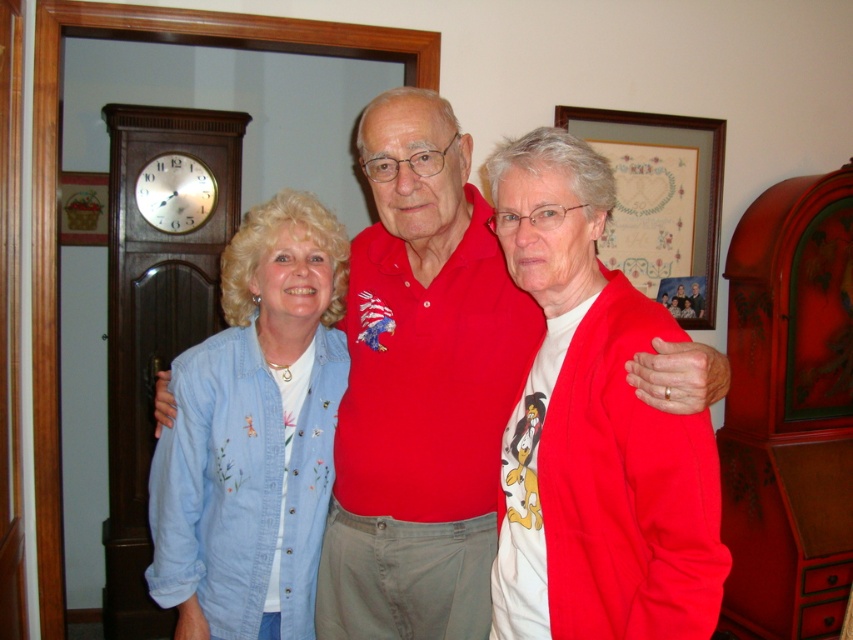
Question: Estimate the real-world distances between objects in this image. Which object is closer to the denim jacket at center?

Choices:
 (A) metallic clock at upper left
 (B) wooden framed picture at upper center

Answer: (B)

Question: Can you confirm if white cotton t-shirt at center is positioned to the right of denim jacket at left?

Choices:
 (A) yes
 (B) no

Answer: (A)

Question: Which of the following is the closest to the observer?

Choices:
 (A) wooden framed picture at upper center
 (B) denim jacket at center

Answer: (B)

Question: Is white cotton t-shirt at center bigger than denim jacket at left?

Choices:
 (A) no
 (B) yes

Answer: (B)

Question: Can you confirm if denim jacket at center is bigger than white cotton t-shirt at center?

Choices:
 (A) no
 (B) yes

Answer: (B)

Question: Which point is closer to the camera?

Choices:
 (A) red cotton polo shirt at center
 (B) metallic clock at upper left
 (C) denim jacket at left
 (D) white cotton t-shirt at center

Answer: (D)